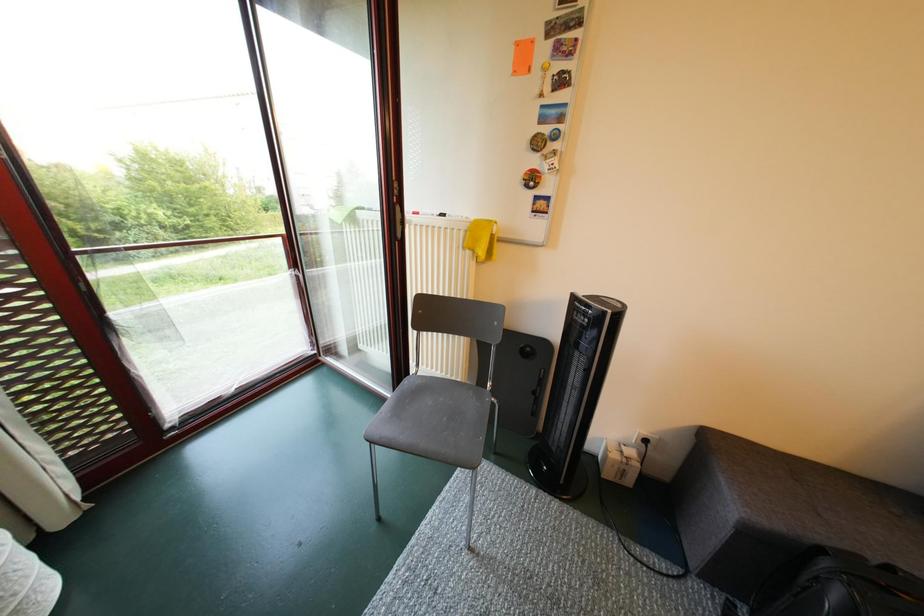
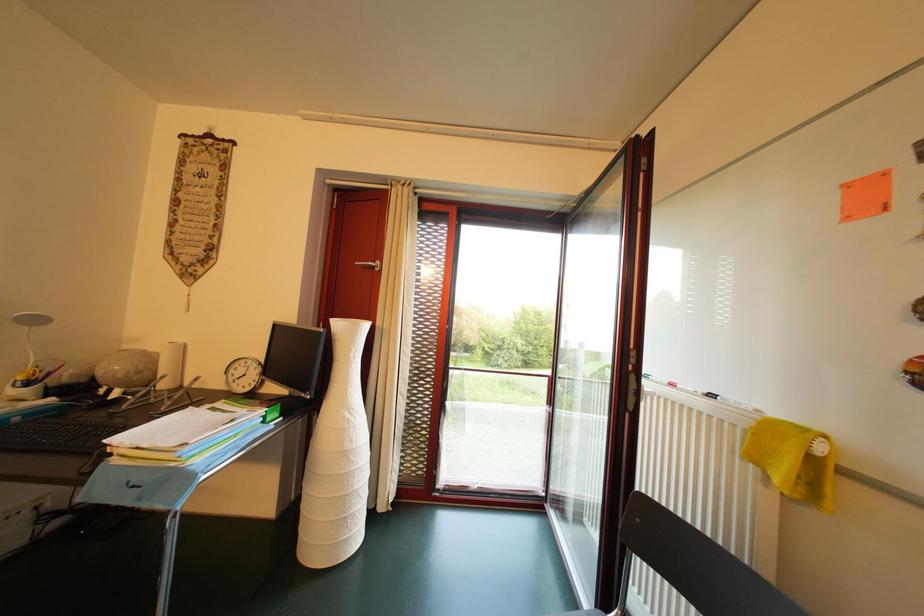
Question: How did the camera likely rotate?

Choices:
 (A) Left
 (B) Right
 (C) Up
 (D) Down

Answer: (A)